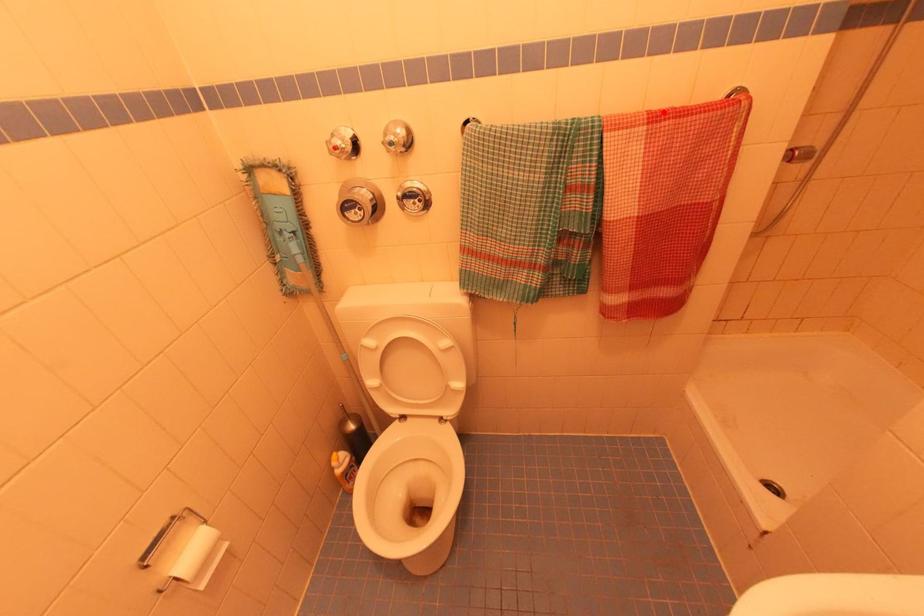
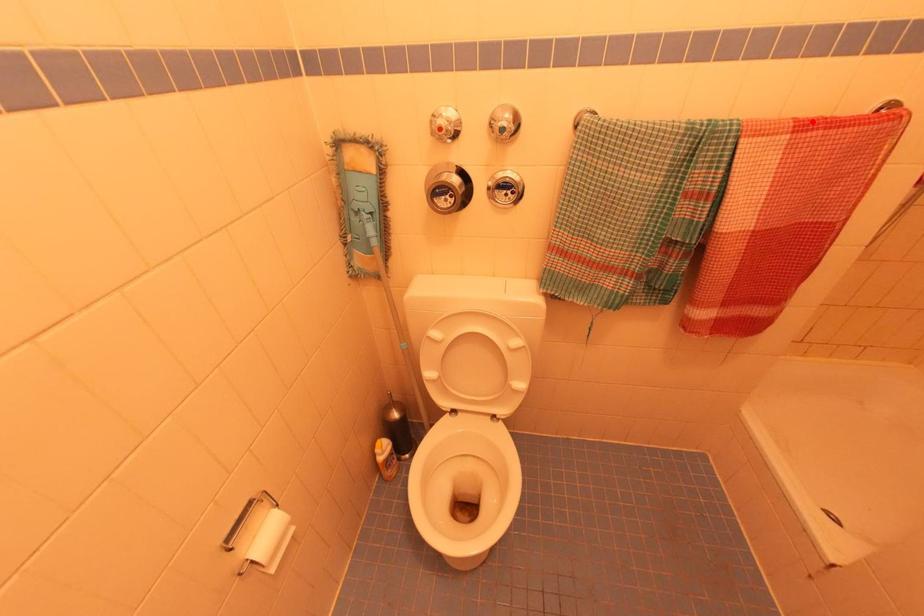
I am providing you with two images of the same scene from different viewpoints. A red point is marked on the first image and another point is marked on the second image. Does the point marked in image1 correspond to the same location as the one in image2?

Yes